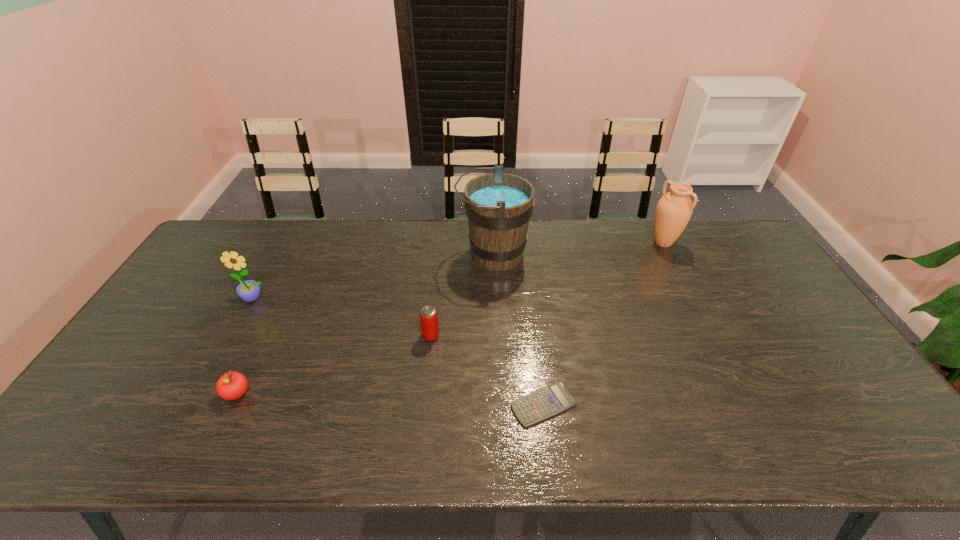
Locate an element on the screen. The image size is (960, 540). empty space between the wine bucket and the shortest object is located at coordinates (518, 329).

Identify the location of vacant area between the wine bucket and the second shortest object. (365, 324).

What are the coordinates of `vacant space in between the beer can and the second tallest object` in the screenshot? It's located at (547, 289).

Locate an element on the screen. vacant area that lies between the urn and the sunflower is located at coordinates (459, 271).

Where is `free space between the shortest object and the sunflower`? free space between the shortest object and the sunflower is located at coordinates (399, 351).

You are a GUI agent. You are given a task and a screenshot of the screen. Output one action in this format:
    pyautogui.click(x=<x>, y=<y>)
    Task: Click on the vacant space that is in between the tallest object and the second shortest object
    This screenshot has width=960, height=540.
    Given the screenshot: What is the action you would take?
    pyautogui.click(x=365, y=324)

Point out which object is positioned as the third nearest to the wine bucket. Please provide its 2D coordinates. Your answer should be formatted as a tuple, i.e. [(x, y)], where the tuple contains the x and y coordinates of a point satisfying the conditions above.

[(673, 212)]

The image size is (960, 540). Identify the location of object that stands as the third closest to the fifth tallest object. (498, 205).

You are a GUI agent. You are given a task and a screenshot of the screen. Output one action in this format:
    pyautogui.click(x=<x>, y=<y>)
    Task: Click on the vacant space that satisfies the following two spatial constraints: 1. with a handle on the side of the tallest object; 2. on the front side of the apple
    
    Given the screenshot: What is the action you would take?
    pyautogui.click(x=498, y=394)

Identify the location of vacant region that satisfies the following two spatial constraints: 1. with a handle on the side of the shortest object; 2. on the left side of the tallest object. The height and width of the screenshot is (540, 960). (498, 404).